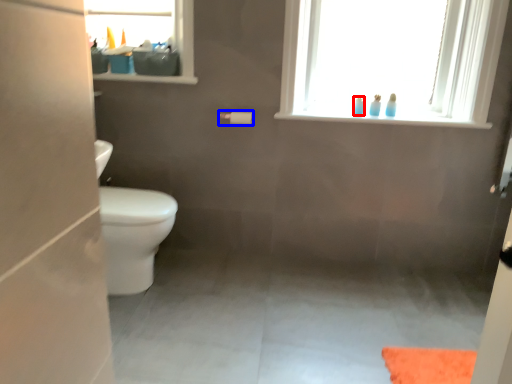
Question: Which point is further to the camera, toiletry (highlighted by a red box) or toilet paper (highlighted by a blue box)?

Choices:
 (A) toiletry
 (B) toilet paper

Answer: (A)